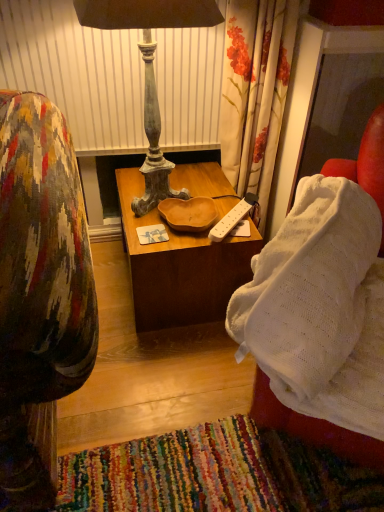
Question: Is distressed wood lamp at center to the left or to the right of wooden table at center in the image?

Choices:
 (A) right
 (B) left

Answer: (B)

Question: Does point (137, 205) appear closer or farther from the camera than point (127, 199)?

Choices:
 (A) closer
 (B) farther

Answer: (A)

Question: Which of these objects is positioned farthest from the white knitted blanket at right?

Choices:
 (A) distressed wood lamp at center
 (B) white plastic power strip at center
 (C) wooden table at center

Answer: (A)

Question: Which object is positioned farthest from the white plastic power strip at center?

Choices:
 (A) distressed wood lamp at center
 (B) white knitted blanket at right
 (C) wooden table at center

Answer: (B)